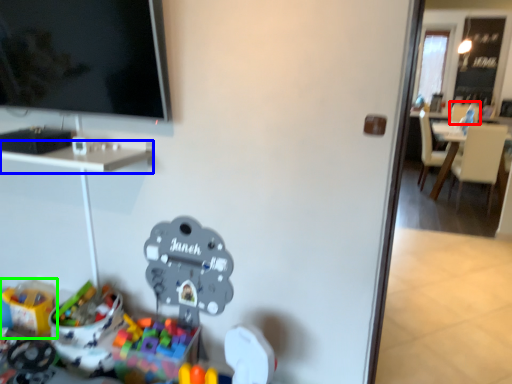
Question: Considering the real-world distances, which object is farthest from armchair (highlighted by a red box)? desk (highlighted by a blue box) or toy (highlighted by a green box)?

Choices:
 (A) desk
 (B) toy

Answer: (B)